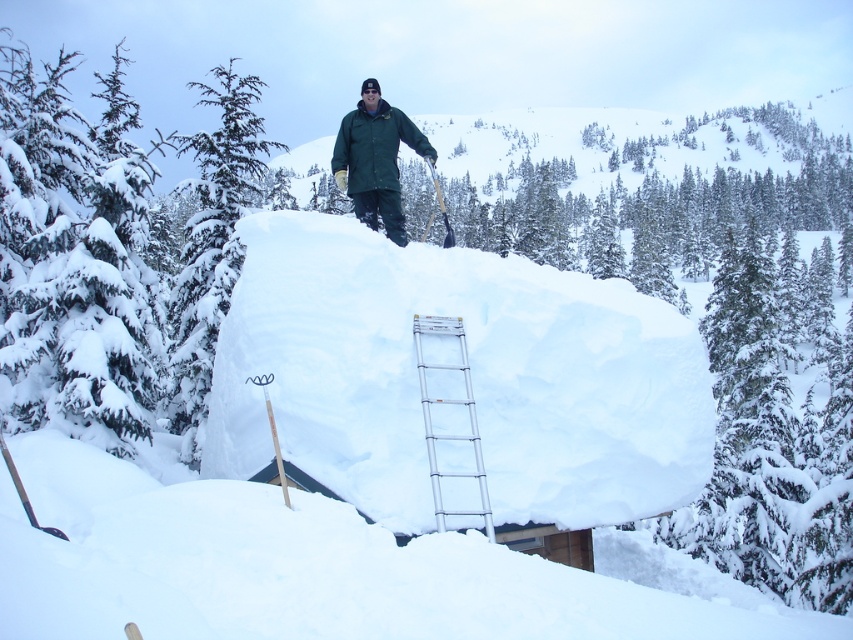
Question: Is the position of snowy evergreen tree at left more distant than that of green matte jacket at upper center?

Choices:
 (A) no
 (B) yes

Answer: (B)

Question: Is white fluffy snow at center closer to camera compared to silver metallic ladder at center?

Choices:
 (A) no
 (B) yes

Answer: (A)

Question: Which object appears farthest from the camera in this image?

Choices:
 (A) silver metallic ladder at center
 (B) green matte jacket at upper center

Answer: (B)

Question: Can you confirm if white fluffy snow at center is thinner than silver metallic ladder at center?

Choices:
 (A) yes
 (B) no

Answer: (B)

Question: Among these points, which one is farthest from the camera?

Choices:
 (A) (439, 269)
 (B) (370, 145)

Answer: (B)

Question: Which is nearer to the white fluffy snow at center?

Choices:
 (A) silver metallic ladder at center
 (B) green matte jacket at upper center
 (C) snowy evergreen tree at left

Answer: (A)